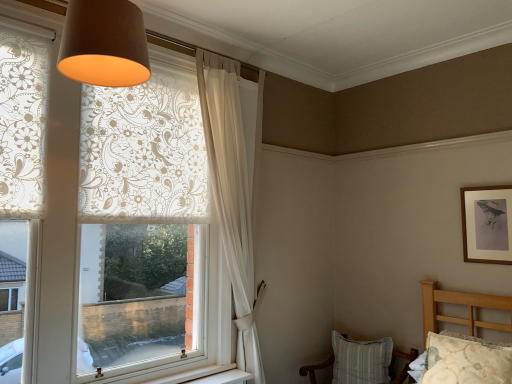
Question: Can you confirm if striped fabric chair at lower right is bigger than brown fabric lampshade at upper center?

Choices:
 (A) yes
 (B) no

Answer: (A)

Question: Is striped fabric chair at lower right beside brown fabric lampshade at upper center?

Choices:
 (A) no
 (B) yes

Answer: (A)

Question: Is striped fabric chair at lower right closer to the viewer compared to brown fabric lampshade at upper center?

Choices:
 (A) yes
 (B) no

Answer: (B)

Question: Is striped fabric chair at lower right facing away from brown fabric lampshade at upper center?

Choices:
 (A) no
 (B) yes

Answer: (A)

Question: Does striped fabric chair at lower right have a greater height compared to brown fabric lampshade at upper center?

Choices:
 (A) no
 (B) yes

Answer: (B)

Question: Can you confirm if striped fabric chair at lower right is wider than brown fabric lampshade at upper center?

Choices:
 (A) yes
 (B) no

Answer: (A)

Question: Is striped fabric chair at lower right thinner than white sheer curtain at upper center?

Choices:
 (A) yes
 (B) no

Answer: (B)

Question: Can you confirm if striped fabric chair at lower right is shorter than white sheer curtain at upper center?

Choices:
 (A) no
 (B) yes

Answer: (B)

Question: From the image's perspective, is striped fabric chair at lower right on white sheer curtain at upper center?

Choices:
 (A) yes
 (B) no

Answer: (B)

Question: Would you say striped fabric chair at lower right is a long distance from white sheer curtain at upper center?

Choices:
 (A) yes
 (B) no

Answer: (A)

Question: Is striped fabric chair at lower right at the left side of white sheer curtain at upper center?

Choices:
 (A) no
 (B) yes

Answer: (A)

Question: Would you say striped fabric chair at lower right contains white sheer curtain at upper center?

Choices:
 (A) no
 (B) yes

Answer: (A)

Question: Is white sheer curtain at upper center taller than striped fabric chair at lower right?

Choices:
 (A) no
 (B) yes

Answer: (B)